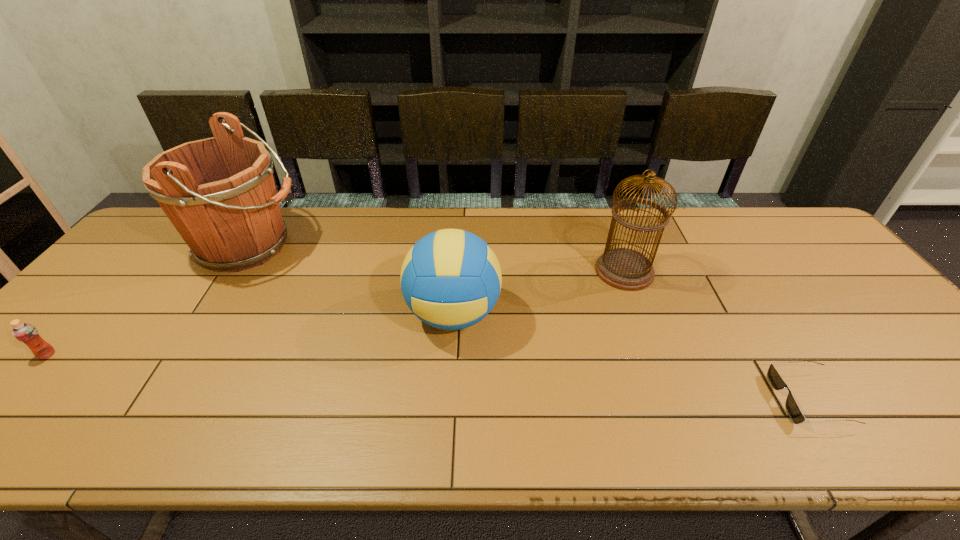
Identify the location of free space at the far edge of the desktop. (576, 234).

The height and width of the screenshot is (540, 960). Identify the location of vacant space at the near edge of the desktop. (171, 419).

The width and height of the screenshot is (960, 540). In the image, there is a desktop. In order to click on vacant region at the left edge in this screenshot , I will do `click(92, 319)`.

Locate an element on the screen. vacant region at the right edge of the desktop is located at coordinates (937, 396).

In the image, there is a desktop. What are the coordinates of `free space at the far left corner` in the screenshot? It's located at (184, 246).

This screenshot has width=960, height=540. Identify the location of free spot between the bucket and the rightmost object. (529, 322).

Locate an element on the screen. Image resolution: width=960 pixels, height=540 pixels. free space between the sunglasses and the leftmost object is located at coordinates (428, 376).

Locate an element on the screen. free space between the third object from left to right and the fourth object from left to right is located at coordinates (539, 293).

At what (x,y) coordinates should I click in order to perform the action: click on vacant area between the second shortest object and the nearest object. Please return your answer as a coordinate pair (x, y). Image resolution: width=960 pixels, height=540 pixels. Looking at the image, I should click on (428, 376).

At what (x,y) coordinates should I click in order to perform the action: click on vacant space in between the nearest object and the birdcage. Please return your answer as a coordinate pair (x, y). This screenshot has width=960, height=540. Looking at the image, I should click on (717, 335).